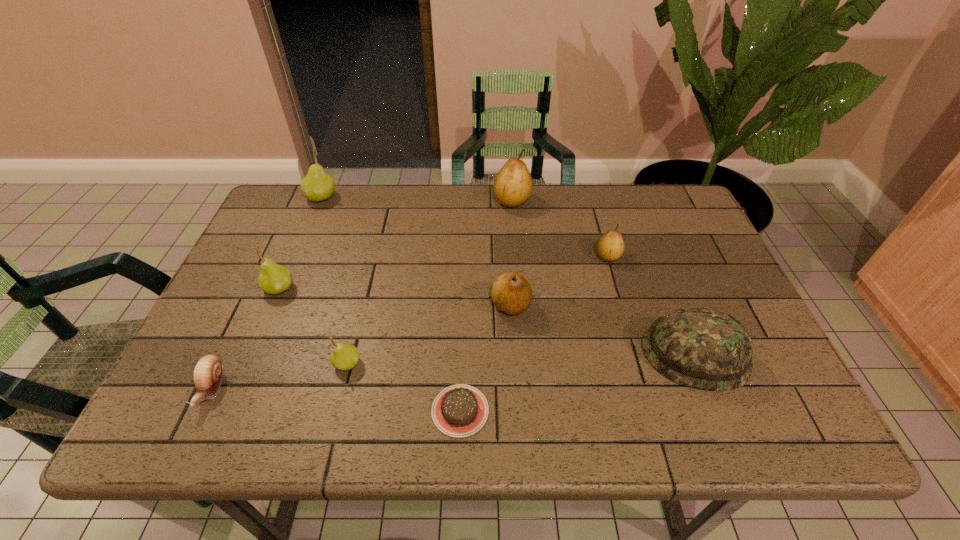
Image resolution: width=960 pixels, height=540 pixels. What are the coordinates of `free space that satisfies the following two spatial constraints: 1. on the back side of the fifth object from right to left; 2. on the right side of the biggest brown pear` in the screenshot? It's located at (468, 200).

Where is `free space that satisfies the following two spatial constraints: 1. on the back side of the smallest brown pear; 2. on the left side of the fourth object from left to right`? free space that satisfies the following two spatial constraints: 1. on the back side of the smallest brown pear; 2. on the left side of the fourth object from left to right is located at coordinates (373, 256).